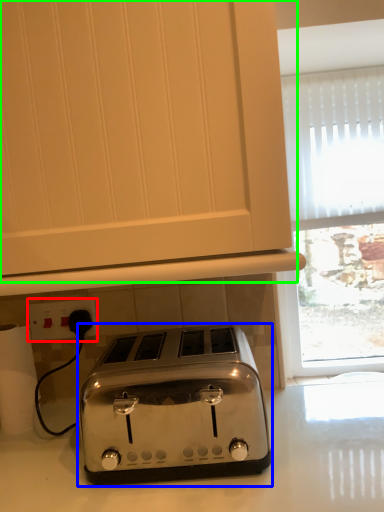
Question: Which is nearer to the electric outlet (highlighted by a red box)? toaster (highlighted by a blue box) or oven (highlighted by a green box).

Choices:
 (A) toaster
 (B) oven

Answer: (A)